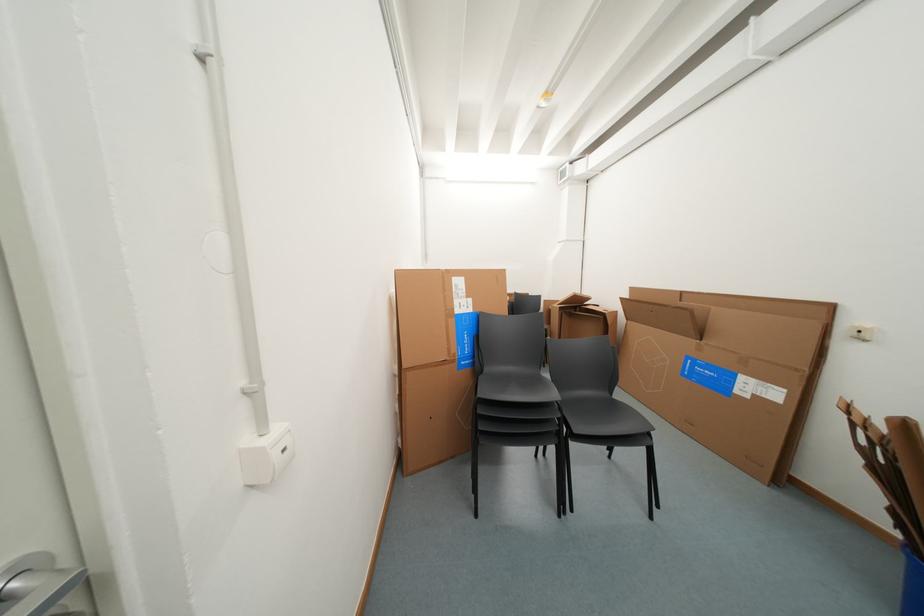
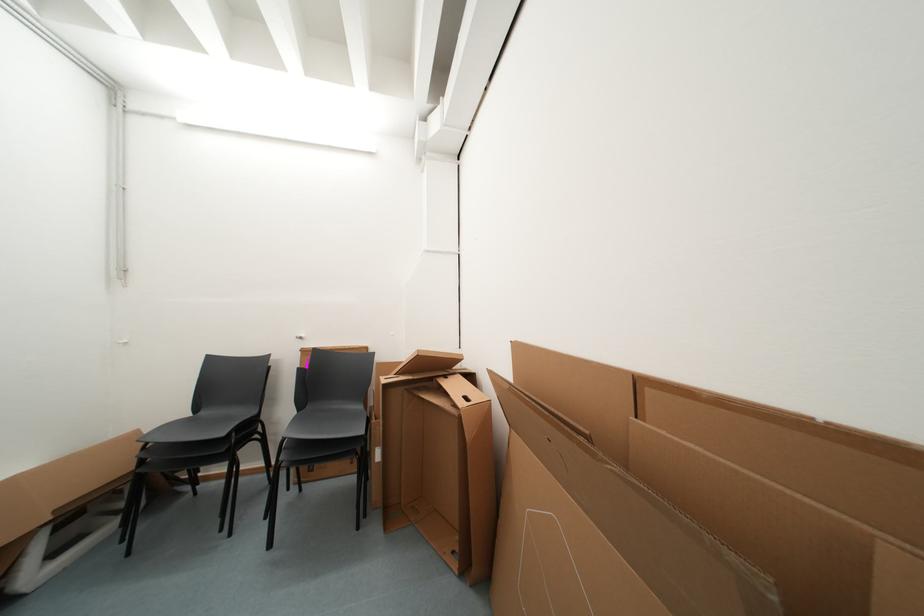
What movement of the cameraman would produce the second image?

The cameraman moved toward right, forward.